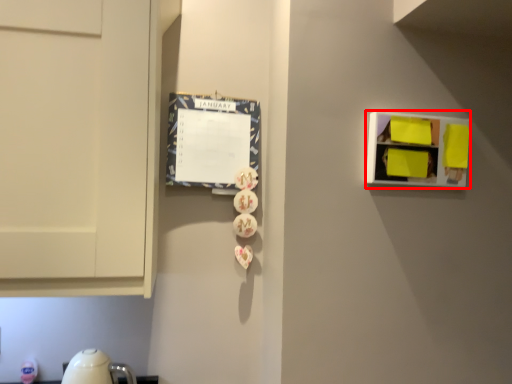
Question: From the image, what is the correct spatial relationship of shelf (annotated by the red box) in relation to bulletin board?

Choices:
 (A) right
 (B) left

Answer: (A)